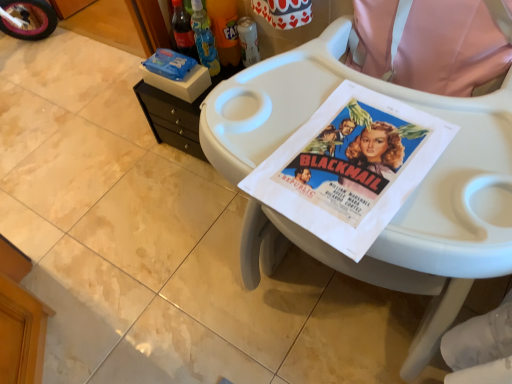
Question: In the image, is white glossy tile at lower left on the left side or the right side of black plastic changing table at upper left?

Choices:
 (A) right
 (B) left

Answer: (B)

Question: Is white glossy tile at lower left in front of or behind black plastic changing table at upper left in the image?

Choices:
 (A) behind
 (B) front

Answer: (B)

Question: Which object is positioned closest to the black plastic changing table at upper left?

Choices:
 (A) white glossy tile at lower left
 (B) translucent plastic bottle at upper center, which appears as the second bottle when viewed from the right
 (C) white plastic feeding chair at center
 (D) metallic can at center, acting as the 3th bottle starting from the left
 (E) translucent plastic bottle at upper center, the 3th bottle from the right

Answer: (E)

Question: Estimate the real-world distances between objects in this image. Which object is closer to the translucent plastic bottle at upper center, the first bottle from the left?

Choices:
 (A) white glossy tile at lower left
 (B) white plastic feeding chair at center
 (C) black plastic changing table at upper left
 (D) metallic can at center, the first bottle in the right-to-left sequence
 (E) translucent plastic bottle at upper center, the 2th bottle positioned from the left

Answer: (E)